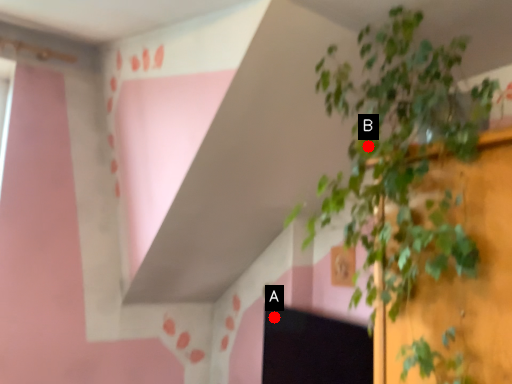
Question: Two points are circled on the image, labeled by A and B beside each circle. Which point is farther to the camera?

Choices:
 (A) A is further
 (B) B is further

Answer: (A)